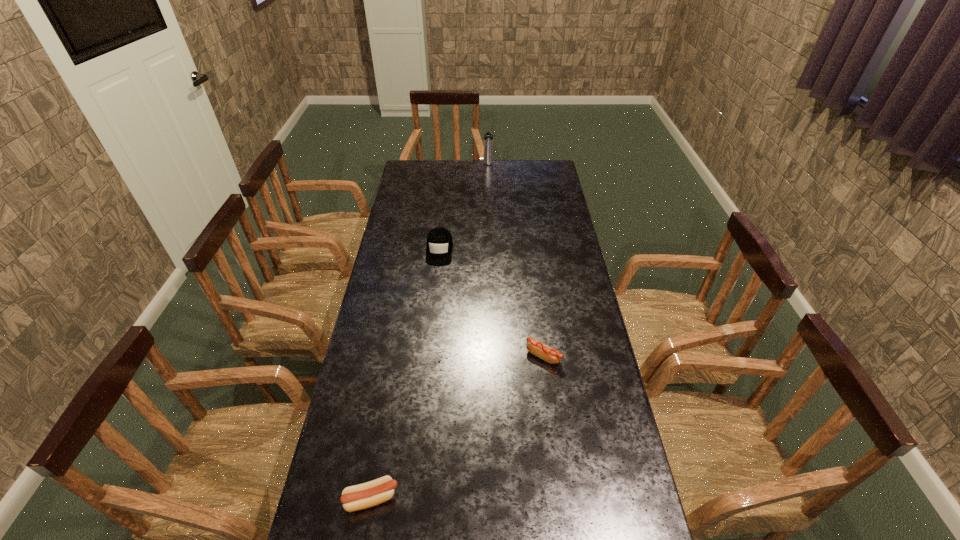
Where is `free space located on the back of the right sausage`? This screenshot has height=540, width=960. free space located on the back of the right sausage is located at coordinates tap(533, 274).

Identify the location of free space located on the right of the nearer sausage. point(427,498).

Identify the location of object positioned at the far edge. This screenshot has width=960, height=540. (488, 137).

At what (x,y) coordinates should I click in order to perform the action: click on object that is at the left edge. Please return your answer as a coordinate pair (x, y). Looking at the image, I should click on (369, 494).

Where is `object situated at the right edge`? This screenshot has width=960, height=540. object situated at the right edge is located at coordinates (549, 354).

The image size is (960, 540). I want to click on vacant region at the far edge, so click(x=473, y=179).

This screenshot has width=960, height=540. In order to click on vacant space at the left edge of the desktop in this screenshot , I will do `click(399, 341)`.

At what (x,y) coordinates should I click in order to perform the action: click on vacant space at the right edge. Please return your answer as a coordinate pair (x, y). This screenshot has width=960, height=540. Looking at the image, I should click on (596, 395).

In the image, there is a desktop. Identify the location of free space at the far left corner. Image resolution: width=960 pixels, height=540 pixels. (431, 184).

You are a GUI agent. You are given a task and a screenshot of the screen. Output one action in this format:
    pyautogui.click(x=<x>, y=<y>)
    Task: Click on the vacant space at the far right corner
    
    Given the screenshot: What is the action you would take?
    pyautogui.click(x=533, y=180)